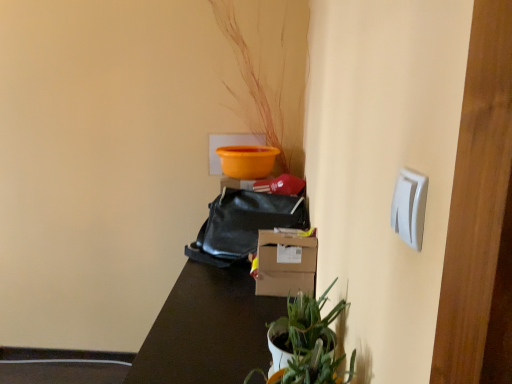
Question: Considering the relative sizes of black leather bag at center and white plastic light switch at upper right in the image provided, is black leather bag at center wider than white plastic light switch at upper right?

Choices:
 (A) yes
 (B) no

Answer: (A)

Question: Is black leather bag at center positioned with its back to white plastic light switch at upper right?

Choices:
 (A) yes
 (B) no

Answer: (B)

Question: From a real-world perspective, is black leather bag at center located beneath white plastic light switch at upper right?

Choices:
 (A) yes
 (B) no

Answer: (A)

Question: Considering the relative sizes of black leather bag at center and white plastic light switch at upper right in the image provided, is black leather bag at center smaller than white plastic light switch at upper right?

Choices:
 (A) yes
 (B) no

Answer: (B)

Question: Is black leather bag at center at the right side of white plastic light switch at upper right?

Choices:
 (A) no
 (B) yes

Answer: (A)

Question: Is point pyautogui.click(x=300, y=332) closer or farther from the camera than point pyautogui.click(x=225, y=246)?

Choices:
 (A) farther
 (B) closer

Answer: (B)

Question: Do you think green matte plant at lower center is within black leather bag at center, or outside of it?

Choices:
 (A) inside
 (B) outside

Answer: (B)

Question: Considering the positions of green matte plant at lower center and black leather bag at center in the image, is green matte plant at lower center wider or thinner than black leather bag at center?

Choices:
 (A) wide
 (B) thin

Answer: (B)

Question: From the image's perspective, is green matte plant at lower center above or below black leather bag at center?

Choices:
 (A) above
 (B) below

Answer: (B)

Question: Is white plastic light switch at upper right situated inside brown matte table at center or outside?

Choices:
 (A) outside
 (B) inside

Answer: (A)

Question: In terms of size, does white plastic light switch at upper right appear bigger or smaller than brown matte table at center?

Choices:
 (A) big
 (B) small

Answer: (B)

Question: From a real-world perspective, is white plastic light switch at upper right positioned above or below brown matte table at center?

Choices:
 (A) above
 (B) below

Answer: (A)

Question: Does point (410, 173) appear closer or farther from the camera than point (201, 355)?

Choices:
 (A) farther
 (B) closer

Answer: (B)

Question: From the image's perspective, relative to brown matte table at center, is green matte plant at lower center above or below?

Choices:
 (A) below
 (B) above

Answer: (B)

Question: In terms of width, does green matte plant at lower center look wider or thinner when compared to brown matte table at center?

Choices:
 (A) wide
 (B) thin

Answer: (B)